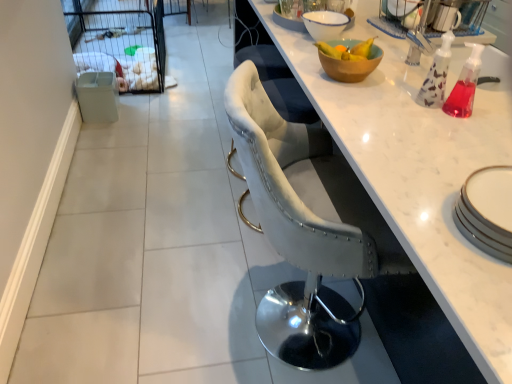
Measure the distance between velvet grey chair at center and camera.

velvet grey chair at center and camera are 37.12 inches apart.

The width and height of the screenshot is (512, 384). Find the location of `velvet grey chair at center`. velvet grey chair at center is located at coordinates (307, 228).

The height and width of the screenshot is (384, 512). I want to click on wooden bowl at upper right, the 2th bowl positioned from the back, so click(x=349, y=67).

This screenshot has width=512, height=384. In order to click on white mesh screen door at upper left in this screenshot , I will do `click(119, 40)`.

The image size is (512, 384). I want to click on white ceramic bowl at upper center, arranged as the 2th bowl when ordered from the bottom, so click(325, 24).

Where is `white marble countertop at center`? white marble countertop at center is located at coordinates (421, 173).

Between white mesh screen door at upper left and wooden bowl at upper right, the 1th bowl positioned from the front, which one has smaller width?

Thinner between the two is wooden bowl at upper right, the 1th bowl positioned from the front.

Can you tell me how much white mesh screen door at upper left and wooden bowl at upper right, the 1th bowl positioned from the bottom, differ in facing direction?

The angular difference between white mesh screen door at upper left and wooden bowl at upper right, the 1th bowl positioned from the bottom, is 2.88 degrees.

From the picture: Which object is more forward, white mesh screen door at upper left or wooden bowl at upper right, the 2th bowl viewed from the top?

wooden bowl at upper right, the 2th bowl viewed from the top, is more forward.

Based on the photo, from a real-world perspective, relative to wooden bowl at upper right, the 2th bowl positioned from the back, is white mesh screen door at upper left vertically above or below?

white mesh screen door at upper left is situated lower than wooden bowl at upper right, the 2th bowl positioned from the back, in the real world.

Consider the image. Is wooden bowl at upper right, the 1th bowl positioned from the bottom, turned away from white marble countertop at center?

No, wooden bowl at upper right, the 1th bowl positioned from the bottom, is not facing away from white marble countertop at center.

From the image's perspective, between wooden bowl at upper right, the 2th bowl viewed from the top, and white marble countertop at center, which one is located above?

white marble countertop at center, from the image's perspective.

Is wooden bowl at upper right, the 2th bowl positioned from the back, located outside white marble countertop at center?

Indeed, wooden bowl at upper right, the 2th bowl positioned from the back, is completely outside white marble countertop at center.

Which object is thinner, wooden bowl at upper right, the 1th bowl positioned from the bottom, or white marble countertop at center?

wooden bowl at upper right, the 1th bowl positioned from the bottom, is thinner.

From a real-world perspective, is velvet grey chair at center positioned over white ceramic bowl at upper center, which is the 1th bowl in back-to-front order, based on gravity?

No.

Would you say velvet grey chair at center is inside or outside white ceramic bowl at upper center, the 2th bowl when ordered from front to back?

velvet grey chair at center cannot be found inside white ceramic bowl at upper center, the 2th bowl when ordered from front to back.

Which is in front, velvet grey chair at center or white ceramic bowl at upper center, the 2th bowl when ordered from front to back?

velvet grey chair at center.

Would you say velvet grey chair at center is a long distance from white ceramic bowl at upper center, the 2th bowl when ordered from front to back?

velvet grey chair at center is near white ceramic bowl at upper center, the 2th bowl when ordered from front to back, not far away.

Based on the photo, is white ceramic bowl at upper center, positioned as the 1th bowl in top-to-bottom order, placed right next to white marble countertop at center?

No, white ceramic bowl at upper center, positioned as the 1th bowl in top-to-bottom order, is not with white marble countertop at center.

From a real-world perspective, which is physically above, white ceramic bowl at upper center, arranged as the 2th bowl when ordered from the bottom, or white marble countertop at center?

white ceramic bowl at upper center, arranged as the 2th bowl when ordered from the bottom, from a real-world perspective.

Could you measure the distance between white ceramic bowl at upper center, arranged as the 2th bowl when ordered from the bottom, and white marble countertop at center?

white ceramic bowl at upper center, arranged as the 2th bowl when ordered from the bottom, and white marble countertop at center are 17.19 inches apart from each other.

From the image's perspective, count 1st bowls downward from the white marble countertop at center and point to it. Please provide its 2D coordinates.

[(325, 24)]

Considering the relative sizes of white ceramic bowl at upper center, which is the 1th bowl in back-to-front order, and white mesh screen door at upper left in the image provided, is white ceramic bowl at upper center, which is the 1th bowl in back-to-front order, shorter than white mesh screen door at upper left?

Yes.

In the scene shown: Measure the distance from white ceramic bowl at upper center, the 2th bowl when ordered from front to back, to white mesh screen door at upper left.

The distance of white ceramic bowl at upper center, the 2th bowl when ordered from front to back, from white mesh screen door at upper left is 7.81 feet.

Which point is more distant from viewer, (335, 20) or (92, 10)?

The point (92, 10) is farther from the camera.

Does white mesh screen door at upper left have a greater height compared to white ceramic bowl at upper center, the 2th bowl when ordered from front to back?

Indeed, white mesh screen door at upper left has a greater height compared to white ceramic bowl at upper center, the 2th bowl when ordered from front to back.

Consider the image. Can white ceramic bowl at upper center, arranged as the 2th bowl when ordered from the bottom, be found inside white mesh screen door at upper left?

Actually, white ceramic bowl at upper center, arranged as the 2th bowl when ordered from the bottom, is outside white mesh screen door at upper left.

How many degrees apart are the facing directions of white mesh screen door at upper left and white ceramic bowl at upper center, positioned as the 1th bowl in top-to-bottom order?

93.8 degrees separate the facing orientations of white mesh screen door at upper left and white ceramic bowl at upper center, positioned as the 1th bowl in top-to-bottom order.

Considering the positions of point (88, 47) and point (336, 12), is point (88, 47) closer or farther from the camera than point (336, 12)?

Clearly, point (88, 47) is more distant from the camera than point (336, 12).

Identify the location of screen door that appears above the velvet grey chair at center (from the image's perspective). (119, 40).

Considering the sizes of velvet grey chair at center and white mesh screen door at upper left in the image, is velvet grey chair at center wider or thinner than white mesh screen door at upper left?

velvet grey chair at center is thinner than white mesh screen door at upper left.

Are velvet grey chair at center and white mesh screen door at upper left beside each other?

No, velvet grey chair at center is not touching white mesh screen door at upper left.

Considering the relative sizes of velvet grey chair at center and white mesh screen door at upper left in the image provided, is velvet grey chair at center shorter than white mesh screen door at upper left?

No, velvet grey chair at center is not shorter than white mesh screen door at upper left.

Where is `bowl that is the 1st object above the white mesh screen door at upper left (from a real-world perspective)`? The height and width of the screenshot is (384, 512). bowl that is the 1st object above the white mesh screen door at upper left (from a real-world perspective) is located at coordinates (349, 67).

At what (x,y) coordinates should I click in order to perform the action: click on bowl in front of the white marble countertop at center. Please return your answer as a coordinate pair (x, y). Looking at the image, I should click on (349, 67).

Considering their positions, is white ceramic bowl at upper center, which is the 1th bowl in back-to-front order, positioned closer to wooden bowl at upper right, the 2th bowl positioned from the back, than white mesh screen door at upper left?

Among the two, white ceramic bowl at upper center, which is the 1th bowl in back-to-front order, is located nearer to wooden bowl at upper right, the 2th bowl positioned from the back.

Which object lies further to the anchor point white marble countertop at center, white ceramic bowl at upper center, the 2th bowl when ordered from front to back, or wooden bowl at upper right, the 2th bowl viewed from the top?

Based on the image, white ceramic bowl at upper center, the 2th bowl when ordered from front to back, appears to be further to white marble countertop at center.

Which object lies nearer to the anchor point white marble countertop at center, white mesh screen door at upper left or white ceramic bowl at upper center, the 2th bowl when ordered from front to back?

white ceramic bowl at upper center, the 2th bowl when ordered from front to back.

Based on their spatial positions, is velvet grey chair at center or white mesh screen door at upper left further from wooden bowl at upper right, the 2th bowl positioned from the back?

The object further to wooden bowl at upper right, the 2th bowl positioned from the back, is white mesh screen door at upper left.

Estimate the real-world distances between objects in this image. Which object is closer to white marble countertop at center, wooden bowl at upper right, the 1th bowl positioned from the front, or white ceramic bowl at upper center, arranged as the 2th bowl when ordered from the bottom?

wooden bowl at upper right, the 1th bowl positioned from the front, is closer to white marble countertop at center.

From the image, which object appears to be farther from velvet grey chair at center, wooden bowl at upper right, the 2th bowl viewed from the top, or white mesh screen door at upper left?

white mesh screen door at upper left lies further to velvet grey chair at center than the other object.

When comparing their distances from white mesh screen door at upper left, does white ceramic bowl at upper center, positioned as the 1th bowl in top-to-bottom order, or white marble countertop at center seem further?

white ceramic bowl at upper center, positioned as the 1th bowl in top-to-bottom order.

Which object lies nearer to the anchor point white marble countertop at center, white ceramic bowl at upper center, positioned as the 1th bowl in top-to-bottom order, or velvet grey chair at center?

Among the two, velvet grey chair at center is located nearer to white marble countertop at center.

At what (x,y) coordinates should I click in order to perform the action: click on countertop between wooden bowl at upper right, the 2th bowl positioned from the back, and white mesh screen door at upper left, along the z-axis. Please return your answer as a coordinate pair (x, y). The height and width of the screenshot is (384, 512). Looking at the image, I should click on (421, 173).

Locate an element on the screen. This screenshot has height=384, width=512. countertop located between velvet grey chair at center and white mesh screen door at upper left in the depth direction is located at coordinates (421, 173).

The image size is (512, 384). In order to click on bowl between white marble countertop at center and white mesh screen door at upper left from front to back in this screenshot , I will do `click(325, 24)`.

Find the location of `countertop between wooden bowl at upper right, the 1th bowl positioned from the bottom, and white ceramic bowl at upper center, arranged as the 2th bowl when ordered from the bottom, in the front-back direction`. countertop between wooden bowl at upper right, the 1th bowl positioned from the bottom, and white ceramic bowl at upper center, arranged as the 2th bowl when ordered from the bottom, in the front-back direction is located at coordinates (421, 173).